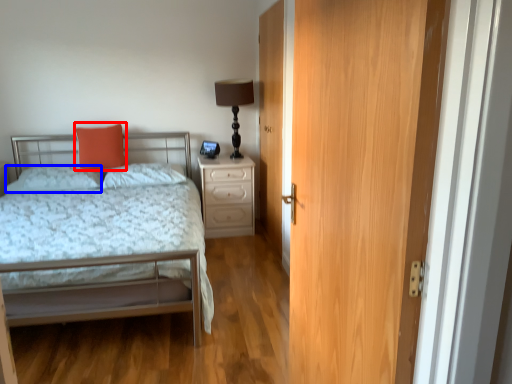
Question: Which of the following is the closest to the observer, throw pillow (highlighted by a red box) or pillow (highlighted by a blue box)?

Choices:
 (A) throw pillow
 (B) pillow

Answer: (B)